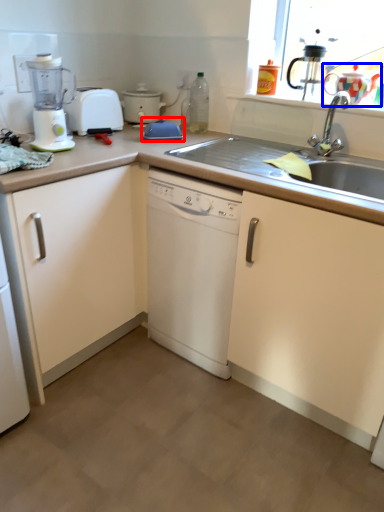
Question: Which object is further to the camera taking this photo, appliance (highlighted by a red box) or tea pot (highlighted by a blue box)?

Choices:
 (A) appliance
 (B) tea pot

Answer: (A)